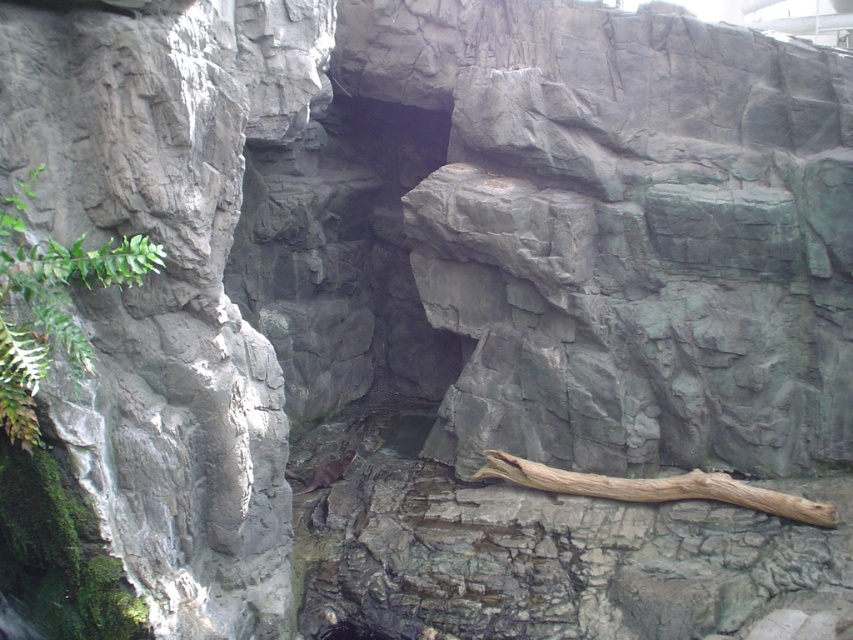
Question: Is brown rough log at lower center smaller than brown furry animal at center?

Choices:
 (A) no
 (B) yes

Answer: (A)

Question: Does brown rough log at lower center appear under brown furry animal at center?

Choices:
 (A) yes
 (B) no

Answer: (B)

Question: Which point is closer to the camera?

Choices:
 (A) green leafy plant at left
 (B) brown furry animal at center
 (C) brown rough log at lower center

Answer: (A)

Question: Which of the following is the farthest from the observer?

Choices:
 (A) (41, 276)
 (B) (824, 513)
 (C) (343, 468)

Answer: (C)

Question: Is green leafy plant at left thinner than brown furry animal at center?

Choices:
 (A) yes
 (B) no

Answer: (B)

Question: Which is farther from the green leafy plant at left?

Choices:
 (A) brown furry animal at center
 (B) brown rough log at lower center

Answer: (B)